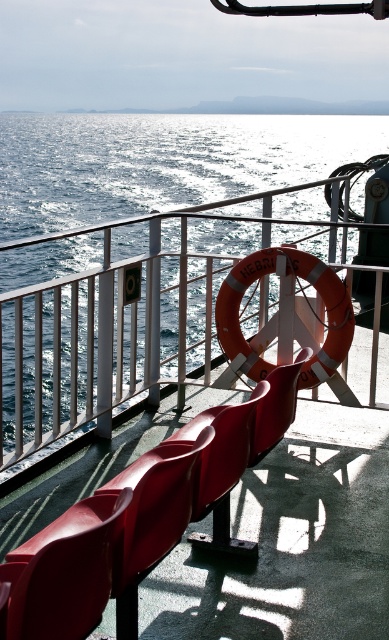
You are standing on the ferry deck and want to move from the point at coordinates point (x=40, y=264) to the point at coordinates point (x=15, y=627). Which direction should you face to walk towards your destination?

To move from point (x=40, y=264) to point (x=15, y=627), you should face forward because point (x=40, y=264) is behind point (x=15, y=627), meaning the destination is in front of you.